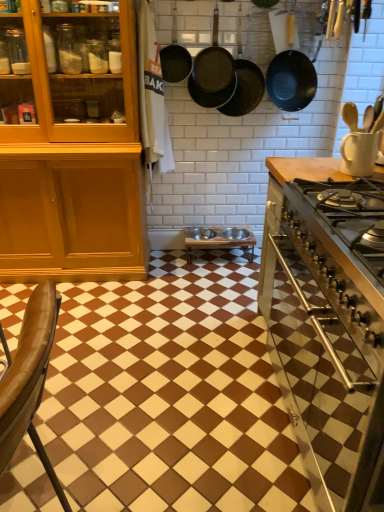
Question: From a real-world perspective, relative to black cast iron frying pan at upper center, the 2th frying pan viewed from the left, is wooden table at center vertically above or below?

Choices:
 (A) below
 (B) above

Answer: (A)

Question: In the image, is wooden table at center on the left side or the right side of black cast iron frying pan at upper center, the 2th frying pan viewed from the left?

Choices:
 (A) left
 (B) right

Answer: (B)

Question: Which is nearer to the white matte mug at upper right?

Choices:
 (A) black cast iron frying pan at upper center, which appears as the 3th frying pan when viewed from the right
 (B) brown leather chair at lower left
 (C) black matte frying pan at upper center, which is the first frying pan in right-to-left order
 (D) matte black frying pan at upper center, which ranks as the fourth frying pan in right-to-left order
 (E) metallic stainless steel stove at right

Answer: (E)

Question: Estimate the real-world distances between objects in this image. Which object is farther from the black cast iron frying pan at upper center, the 2th frying pan viewed from the left?

Choices:
 (A) black matte frying pan at upper center, which is the first frying pan in right-to-left order
 (B) matte black frying pan at upper center, which ranks as the fourth frying pan in right-to-left order
 (C) wooden table at center
 (D) brown glossy tile at center
 (E) dark brown matte frying pan at upper center, which is the second frying pan in right-to-left order

Answer: (D)